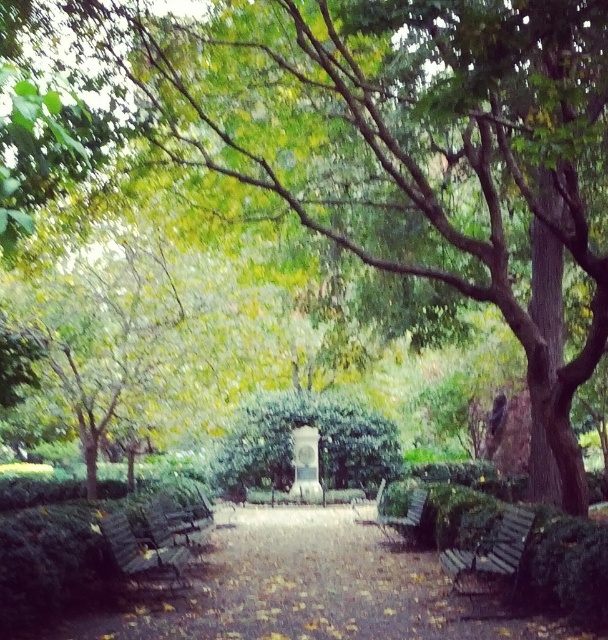
Question: Which point is closer to the camera taking this photo?

Choices:
 (A) (492, 588)
 (B) (269, 608)

Answer: (B)

Question: From the image, what is the correct spatial relationship of wooden bench at center in relation to wooden park bench at center?

Choices:
 (A) right
 (B) left

Answer: (B)

Question: Which object is positioned farthest from the wooden park bench at center?

Choices:
 (A) brown wooden bench at center
 (B) wooden slats bench at lower right

Answer: (A)

Question: Among these points, which one is farthest from the camera?

Choices:
 (A) 168,570
 (B) 381,518

Answer: (B)

Question: Does brown wooden bench at center have a greater width compared to wooden park bench at lower left?

Choices:
 (A) no
 (B) yes

Answer: (B)

Question: Is wooden slats bench at lower right closer to the viewer compared to wooden park bench at lower left?

Choices:
 (A) yes
 (B) no

Answer: (A)